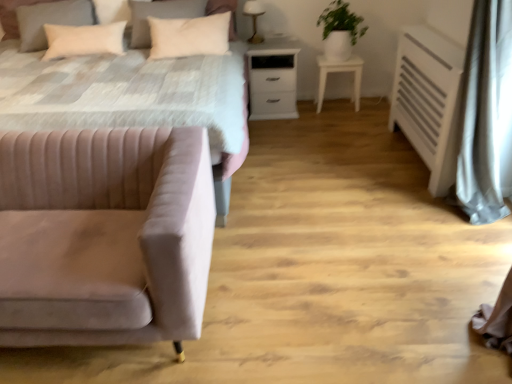
The image size is (512, 384). What do you see at coordinates (254, 18) in the screenshot?
I see `metallic gold table lamp at upper center` at bounding box center [254, 18].

The image size is (512, 384). Identify the location of velvet pink bed at left. (229, 169).

Identify the location of beige velvet pillow at upper left, arranged as the third pillow when viewed from the right. (50, 20).

Identify the location of white sheer curtain at right. The image size is (512, 384). (487, 115).

Considering the sizes of objects white matte nightstand at center and velvet pink bed at left in the image provided, who is thinner, white matte nightstand at center or velvet pink bed at left?

white matte nightstand at center is thinner.

The image size is (512, 384). Find the location of `nightstand behind the velvet pink bed at left`. nightstand behind the velvet pink bed at left is located at coordinates (273, 79).

Is white matte nightstand at center situated inside velvet pink bed at left or outside?

white matte nightstand at center is not enclosed by velvet pink bed at left.

From a real-world perspective, is velvet pink bed at left physically above white glossy side table at center right?

Yes, from a real-world perspective, velvet pink bed at left is over white glossy side table at center right

Considering the relative sizes of velvet pink bed at left and white glossy side table at center right in the image provided, is velvet pink bed at left bigger than white glossy side table at center right?

Yes.

Is velvet pink bed at left not close to white glossy side table at center right?

Yes, velvet pink bed at left is far from white glossy side table at center right.

From the image's perspective, which one is positioned higher, green matte plant at upper right or beige velvet pillow at upper left, arranged as the 1th pillow when viewed from the left?

green matte plant at upper right is shown above in the image.

Is green matte plant at upper right next to beige velvet pillow at upper left, arranged as the third pillow when viewed from the right?

green matte plant at upper right is not next to beige velvet pillow at upper left, arranged as the third pillow when viewed from the right, and they're not touching.

In terms of height, does green matte plant at upper right look taller or shorter compared to beige velvet pillow at upper left, arranged as the 1th pillow when viewed from the left?

In the image, green matte plant at upper right appears to be taller than beige velvet pillow at upper left, arranged as the 1th pillow when viewed from the left.

Considering the sizes of white glossy side table at center right and beige velvet pillow at upper left, arranged as the 1th pillow when viewed from the left, in the image, is white glossy side table at center right taller or shorter than beige velvet pillow at upper left, arranged as the 1th pillow when viewed from the left,?

white glossy side table at center right is taller than beige velvet pillow at upper left, arranged as the 1th pillow when viewed from the left.

From the image's perspective, who appears lower, white glossy side table at center right or beige velvet pillow at upper left, arranged as the third pillow when viewed from the right?

white glossy side table at center right, from the image's perspective.

Does white glossy side table at center right come behind beige velvet pillow at upper left, arranged as the 1th pillow when viewed from the left?

Yes, the depth of white glossy side table at center right is greater than that of beige velvet pillow at upper left, arranged as the 1th pillow when viewed from the left.

Which of these two, white glossy side table at center right or beige velvet pillow at upper left, arranged as the third pillow when viewed from the right, is thinner?

With smaller width is beige velvet pillow at upper left, arranged as the third pillow when viewed from the right.

Is velvet pink couch at lower left oriented away from white glossy side table at center right?

velvet pink couch at lower left is not turned away from white glossy side table at center right.

Does velvet pink couch at lower left have a greater width compared to white glossy side table at center right?

Yes.

Who is taller, velvet pink couch at lower left or white glossy side table at center right?

velvet pink couch at lower left is taller.

From a real-world perspective, is white soft pillow at upper left, marked as the 1th pillow in a right-to-left arrangement, below white sheer curtain at right?

Incorrect, from a real-world perspective, white soft pillow at upper left, marked as the 1th pillow in a right-to-left arrangement, is higher than white sheer curtain at right.

Is white soft pillow at upper left, which appears as the 3th pillow when viewed from the left, positioned with its back to white sheer curtain at right?

That's not correct — white soft pillow at upper left, which appears as the 3th pillow when viewed from the left, is not looking away from white sheer curtain at right.

In the scene shown: Does white soft pillow at upper left, which appears as the 3th pillow when viewed from the left, contain white sheer curtain at right?

Actually, white sheer curtain at right is outside white soft pillow at upper left, which appears as the 3th pillow when viewed from the left.

Would you say white soft pillow at upper left, which is counted as the second pillow, starting from the left, is to the left or to the right of metallic gold table lamp at upper center in the picture?

white soft pillow at upper left, which is counted as the second pillow, starting from the left, is to the left of metallic gold table lamp at upper center.

Between white soft pillow at upper left, placed as the 2th pillow when sorted from right to left, and metallic gold table lamp at upper center, which one has more height?

white soft pillow at upper left, placed as the 2th pillow when sorted from right to left, is taller.

From a real-world perspective, is white soft pillow at upper left, which is counted as the second pillow, starting from the left, physically above metallic gold table lamp at upper center?

Yes, from a real-world perspective, white soft pillow at upper left, which is counted as the second pillow, starting from the left, is on top of metallic gold table lamp at upper center.

Could you tell me if white soft pillow at upper left, which is counted as the second pillow, starting from the left, is turned towards metallic gold table lamp at upper center?

No, white soft pillow at upper left, which is counted as the second pillow, starting from the left, is not aimed at metallic gold table lamp at upper center.

Where is `bed below the white matte nightstand at center (from the image's perspective)`? The width and height of the screenshot is (512, 384). bed below the white matte nightstand at center (from the image's perspective) is located at coordinates (229, 169).

I want to click on bed that appears above the white glossy side table at center right (from a real-world perspective), so click(229, 169).

From the image, which object appears to be nearer to white sheer curtain at right, green matte plant at upper right or white soft pillow at upper left, placed as the 2th pillow when sorted from right to left?

green matte plant at upper right.

Which object lies further to the anchor point metallic gold table lamp at upper center, white glossy side table at center right or white matte nightstand at center?

The object further to metallic gold table lamp at upper center is white glossy side table at center right.

Looking at the image, which one is located further to white soft pillow at upper left, marked as the 1th pillow in a right-to-left arrangement, metallic gold table lamp at upper center or white sheer curtain at right?

white sheer curtain at right is further to white soft pillow at upper left, marked as the 1th pillow in a right-to-left arrangement.

Looking at the image, which one is located closer to white sheer curtain at right, white soft pillow at upper left, placed as the 2th pillow when sorted from right to left, or beige velvet pillow at upper left, arranged as the 1th pillow when viewed from the left?

Among the two, white soft pillow at upper left, placed as the 2th pillow when sorted from right to left, is located nearer to white sheer curtain at right.

Which object lies nearer to the anchor point beige velvet pillow at upper left, arranged as the 1th pillow when viewed from the left, green matte plant at upper right or white soft pillow at upper left, marked as the 1th pillow in a right-to-left arrangement?

Based on the image, white soft pillow at upper left, marked as the 1th pillow in a right-to-left arrangement, appears to be nearer to beige velvet pillow at upper left, arranged as the 1th pillow when viewed from the left.

Considering their positions, is beige velvet pillow at upper left, arranged as the third pillow when viewed from the right, positioned further to white soft pillow at upper left, marked as the 1th pillow in a right-to-left arrangement, than white sheer curtain at right?

Based on the image, white sheer curtain at right appears to be further to white soft pillow at upper left, marked as the 1th pillow in a right-to-left arrangement.

Estimate the real-world distances between objects in this image. Which object is closer to white soft pillow at upper left, which appears as the 3th pillow when viewed from the left, white glossy side table at center right or white soft pillow at upper left, which is counted as the second pillow, starting from the left?

white soft pillow at upper left, which is counted as the second pillow, starting from the left.

From the image, which object appears to be nearer to green matte plant at upper right, metallic gold table lamp at upper center or beige velvet pillow at upper left, arranged as the 1th pillow when viewed from the left?

Based on the image, metallic gold table lamp at upper center appears to be nearer to green matte plant at upper right.

This screenshot has width=512, height=384. What are the coordinates of `table between velvet pink bed at left and white sheer curtain at right in the horizontal direction` in the screenshot? It's located at (339, 71).

The width and height of the screenshot is (512, 384). Identify the location of pillow between velvet pink bed at left and white soft pillow at upper left, placed as the 2th pillow when sorted from right to left, in the front-back direction. (189, 36).

You are a GUI agent. You are given a task and a screenshot of the screen. Output one action in this format:
    pyautogui.click(x=<x>, y=<y>)
    Task: Click on the nightstand located between white sheer curtain at right and white glossy side table at center right in the depth direction
    The height and width of the screenshot is (384, 512).
    Given the screenshot: What is the action you would take?
    pyautogui.click(x=273, y=79)

Locate an element on the screen. This screenshot has height=384, width=512. curtain between velvet pink couch at lower left and metallic gold table lamp at upper center along the z-axis is located at coordinates (487, 115).